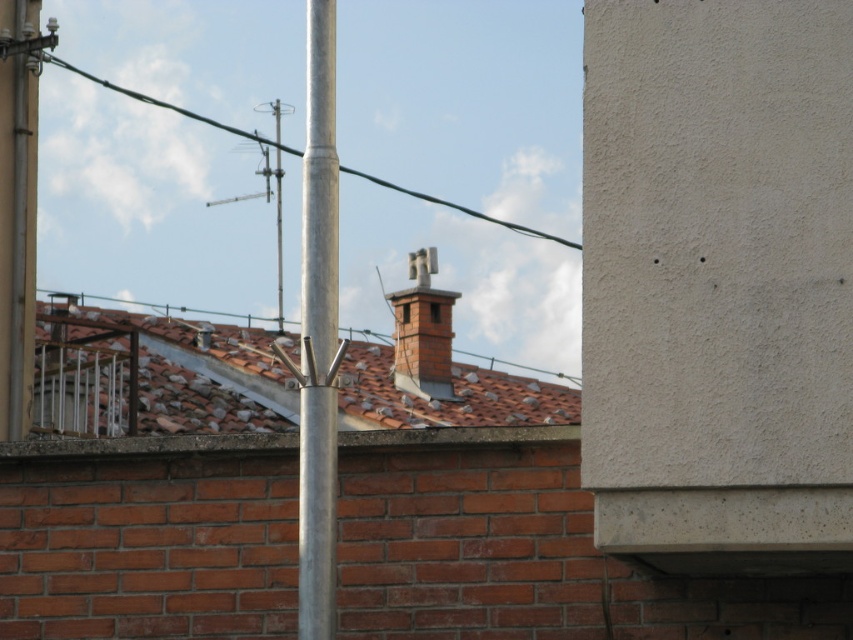
From the picture: You are a drone operator trying to position a drone to capture a photo of the silver metallic pole at center. The drone must hover exactly at the coordinates provided in the scene description. What are the coordinates where the drone should hover?

The silver metallic pole at center is located at point (318, 332), so the drone should hover at those coordinates to capture the photo.

You are a maintenance worker assessing the rooftop. You see the silver metallic pole at center and the green wire at upper center. Which object is shorter?

The silver metallic pole at center is not as tall as the green wire at upper center, so the silver metallic pole at center is shorter.